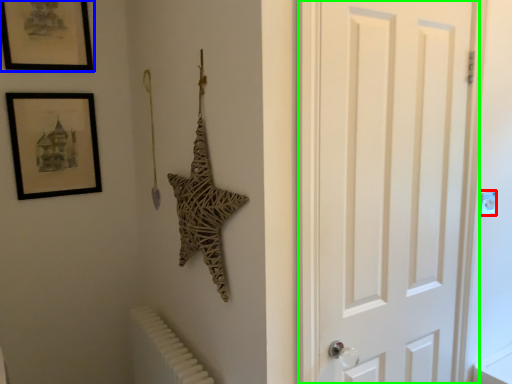
Question: Which object is the farthest from light switch (highlighted by a red box)? Choose among these: picture frame (highlighted by a blue box) or door (highlighted by a green box).

Choices:
 (A) picture frame
 (B) door

Answer: (A)